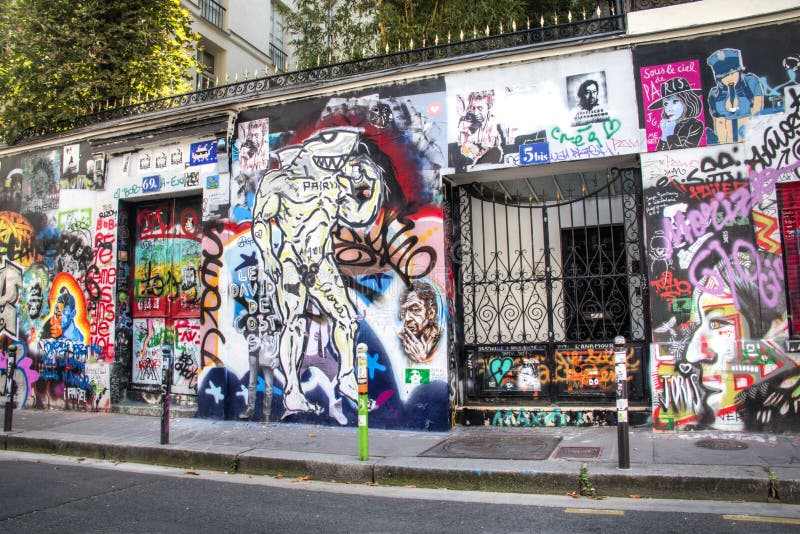
Find the location of a particular element. Image resolution: width=800 pixels, height=534 pixels. green bowl is located at coordinates (360, 434).